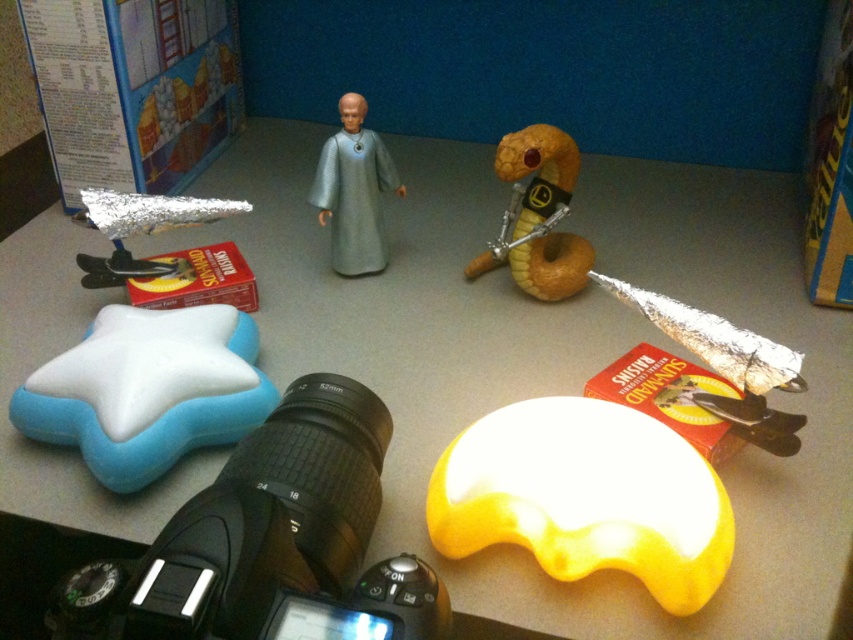
You are a photographer setting up a scene on a table. You have two points marked on the table for placing props. The first point is at coordinate point [229,492] and the second point is at coordinate point [123,468]. Which point is closer to the camera lens?

Point [229,492] is closer to the camera lens than point [123,468].

You are a photographer setting up a scene on a table. You have two points marked on the table for placing props. The first point is at coordinates point (407, 637) and the second is at point (364, 100). Which point is closer to the camera lens?

Point (407, 637) is closer to the camera lens than point (364, 100).